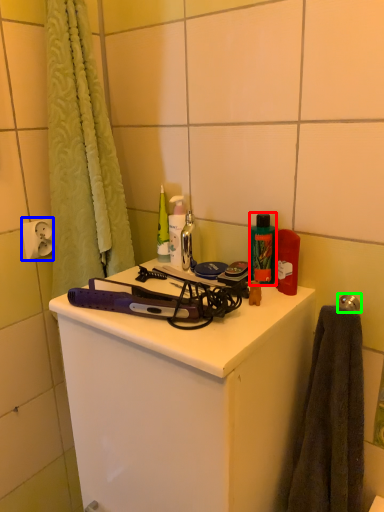
Question: Which is farther away from toiletry (highlighted by a red box)? electric outlet (highlighted by a blue box) or towel bar (highlighted by a green box)?

Choices:
 (A) electric outlet
 (B) towel bar

Answer: (A)